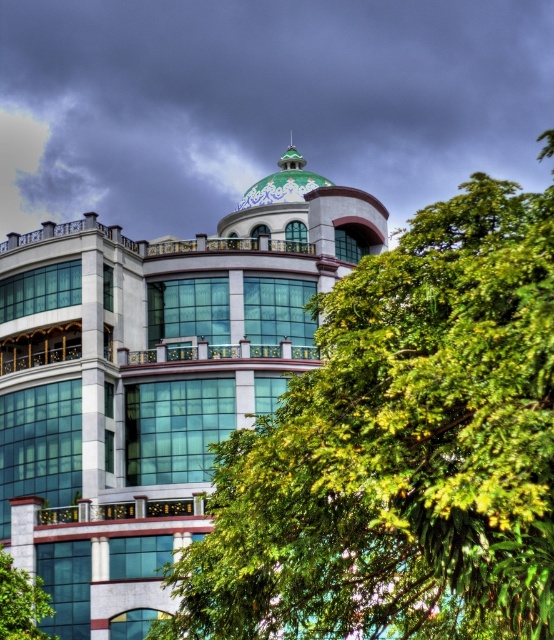
Question: Observing the image, what is the correct spatial positioning of green leafy tree at upper center in reference to green glass building at center?

Choices:
 (A) left
 (B) right

Answer: (B)

Question: Which point is farther to the camera?

Choices:
 (A) green leafy tree at upper center
 (B) green glossy dome at upper center
 (C) green glass building at center

Answer: (B)

Question: Is green leafy tree at upper center smaller than green glossy dome at upper center?

Choices:
 (A) yes
 (B) no

Answer: (B)

Question: Estimate the real-world distances between objects in this image. Which object is farther from the green glass building at center?

Choices:
 (A) green glossy dome at upper center
 (B) green leafy tree at upper center

Answer: (A)

Question: Is green leafy tree at upper center smaller than green glossy dome at upper center?

Choices:
 (A) no
 (B) yes

Answer: (A)

Question: Which object is positioned farthest from the green glass building at center?

Choices:
 (A) green glossy dome at upper center
 (B) green leafy tree at upper center

Answer: (A)